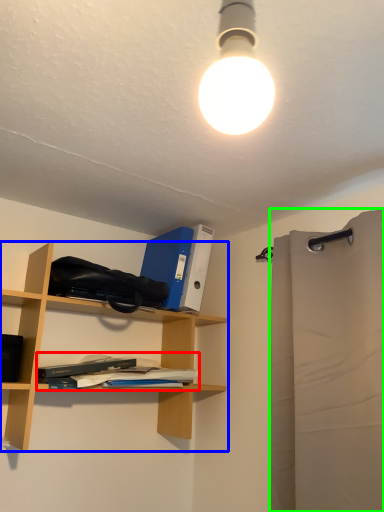
Question: Which object is positioned closest to book (highlighted by a red box)? Select from shelf (highlighted by a blue box) and shower curtain (highlighted by a green box).

Choices:
 (A) shelf
 (B) shower curtain

Answer: (A)